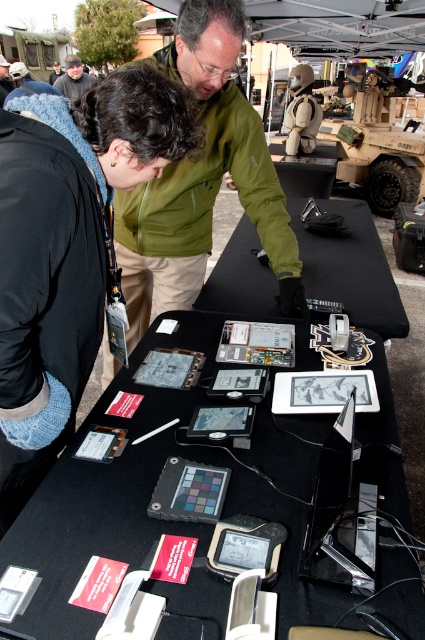
Question: Which object is farther from the camera taking this photo?

Choices:
 (A) black fabric at center
 (B) dark gray jacket at upper left

Answer: (B)

Question: Which object appears farthest from the camera in this image?

Choices:
 (A) dark gray jacket at upper left
 (B) black fleece jacket at upper left
 (C) green fabric jacket at upper center

Answer: (A)

Question: Which object appears farthest from the camera in this image?

Choices:
 (A) jeans at lower left
 (B) black fabric at center
 (C) dark gray jacket at upper left
 (D) black fleece jacket at upper left

Answer: (C)

Question: Can you confirm if black fleece jacket at upper left is thinner than green fabric jacket at upper center?

Choices:
 (A) no
 (B) yes

Answer: (B)

Question: Does black fleece jacket at upper left have a lesser width compared to dark gray jacket at upper left?

Choices:
 (A) no
 (B) yes

Answer: (B)

Question: Is the position of green fabric jacket at upper center more distant than that of jeans at lower left?

Choices:
 (A) yes
 (B) no

Answer: (A)